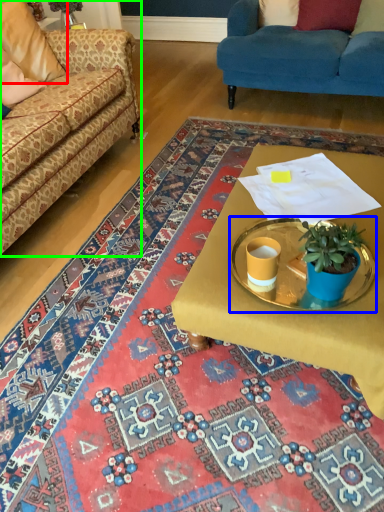
Question: Considering the real-world distances, which object is farthest from pillow (highlighted by a red box)? round table (highlighted by a blue box) or studio couch (highlighted by a green box)?

Choices:
 (A) round table
 (B) studio couch

Answer: (A)